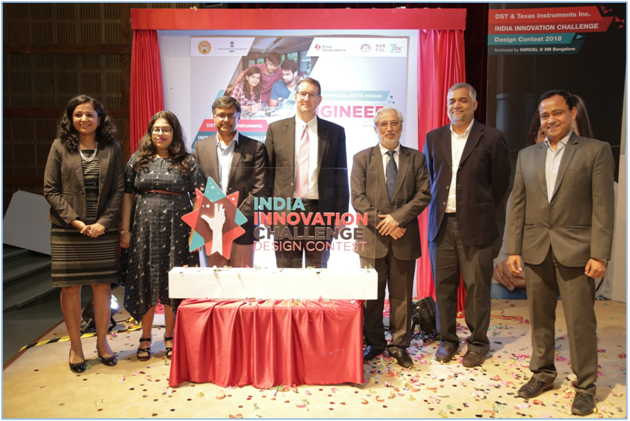
Identify the location of table cloth. (285, 347).